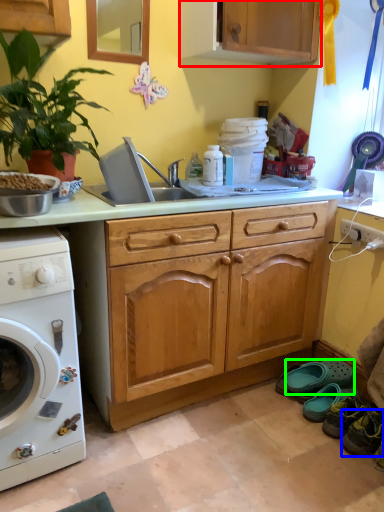
Question: Considering the real-world distances, which object is closest to cabinetry (highlighted by a red box)? shoe (highlighted by a blue box) or shoe (highlighted by a green box).

Choices:
 (A) shoe
 (B) shoe

Answer: (B)